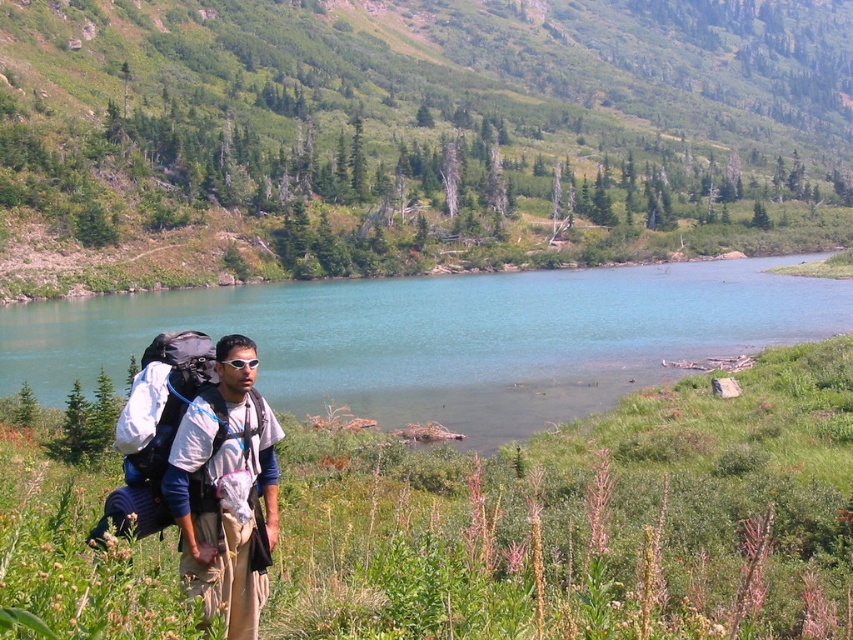
Question: Which of the following is the closest to the observer?

Choices:
 (A) (341, 291)
 (B) (228, 566)

Answer: (B)

Question: Which point is farther from the camera taking this photo?

Choices:
 (A) (152, 410)
 (B) (74, 157)
 (C) (788, 291)

Answer: (B)

Question: Does white fabric backpack at center have a smaller size compared to matte black backpack at lower left?

Choices:
 (A) no
 (B) yes

Answer: (A)

Question: Based on their relative distances, which object is farther from the matte black backpack at lower left?

Choices:
 (A) white fabric backpack at center
 (B) clear blue water at center
 (C) green grassy hillside at upper center

Answer: (C)

Question: Does white fabric backpack at center appear on the left side of matte black backpack at lower left?

Choices:
 (A) no
 (B) yes

Answer: (A)

Question: Can you confirm if white fabric backpack at center is thinner than matte black backpack at lower left?

Choices:
 (A) yes
 (B) no

Answer: (B)